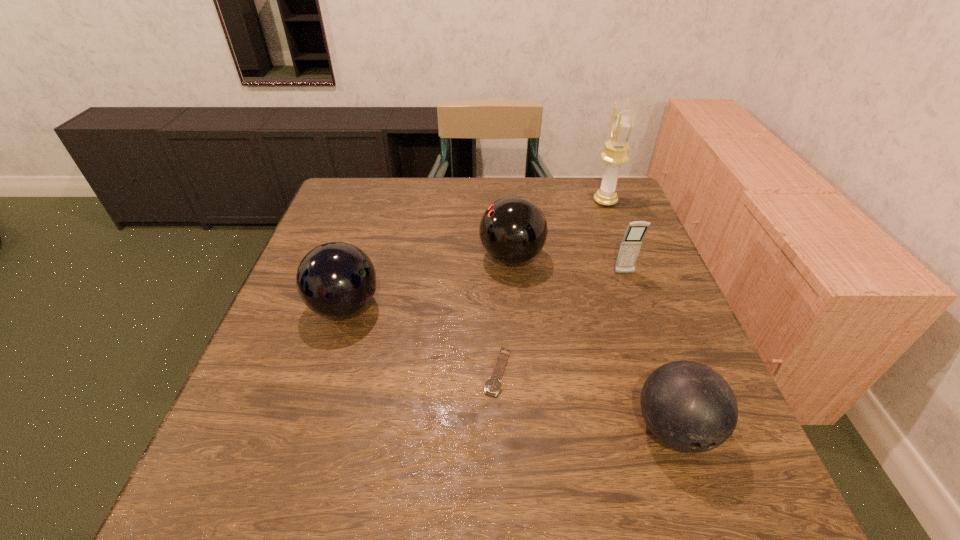
At what (x,y) coordinates should I click in order to perform the action: click on the farthest object. Please return your answer as a coordinate pair (x, y). This screenshot has height=540, width=960. Looking at the image, I should click on (622, 121).

Where is `the tallest object`? the tallest object is located at coordinates (622, 121).

This screenshot has height=540, width=960. Identify the location of the farthest bowling ball. (513, 230).

The height and width of the screenshot is (540, 960). Identify the location of the fourth farthest object. (335, 279).

You are a GUI agent. You are given a task and a screenshot of the screen. Output one action in this format:
    pyautogui.click(x=<x>, y=<y>)
    Task: Click on the leftmost bowling ball
    
    Given the screenshot: What is the action you would take?
    pyautogui.click(x=335, y=279)

This screenshot has height=540, width=960. Identify the location of cellular telephone. (630, 246).

The height and width of the screenshot is (540, 960). I want to click on the nearest bowling ball, so click(688, 406).

Locate an element on the screen. The height and width of the screenshot is (540, 960). the shortest object is located at coordinates (493, 385).

Identify the location of vacant space located on the front-facing side of the award. The width and height of the screenshot is (960, 540). (563, 201).

This screenshot has height=540, width=960. What are the coordinates of `blank area located 0.270m on the front-facing side of the award` in the screenshot? It's located at (502, 201).